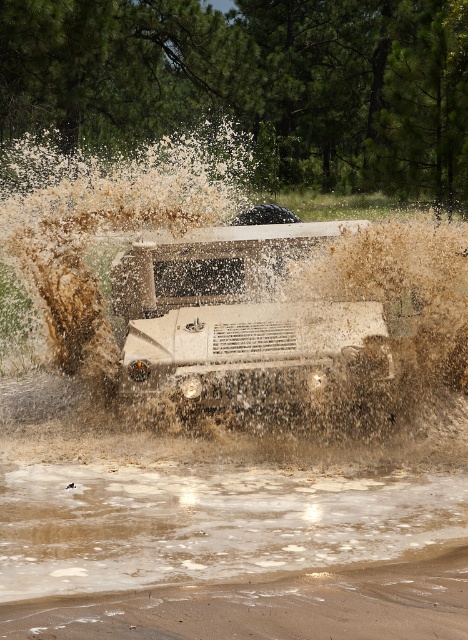
Question: Does white matte jeep at center have a larger size compared to brown sandy dirt track at lower center?

Choices:
 (A) yes
 (B) no

Answer: (A)

Question: Does brown textured mud at center have a larger size compared to brown muddy water at lower center?

Choices:
 (A) yes
 (B) no

Answer: (A)

Question: Considering the real-world distances, which object is closest to the brown textured mud at center?

Choices:
 (A) brown sandy dirt track at lower center
 (B) white matte jeep at center
 (C) brown muddy water at lower center

Answer: (B)

Question: Among these objects, which one is farthest from the camera?

Choices:
 (A) white matte jeep at center
 (B) brown sandy dirt track at lower center
 (C) brown muddy water at lower center

Answer: (A)

Question: Estimate the real-world distances between objects in this image. Which object is closer to the white matte jeep at center?

Choices:
 (A) brown sandy dirt track at lower center
 (B) brown muddy water at lower center

Answer: (B)

Question: Does brown textured mud at center come behind white matte jeep at center?

Choices:
 (A) no
 (B) yes

Answer: (A)